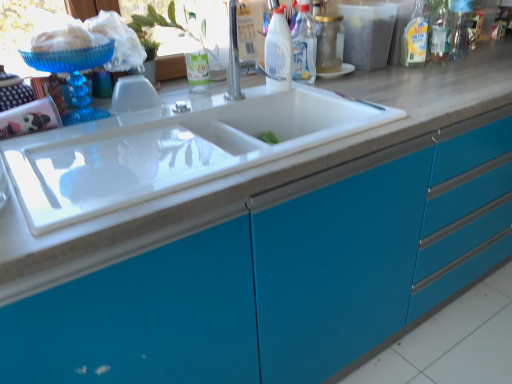
This screenshot has width=512, height=384. Find the location of `free space to the right of silver metallic faucet at upper center`. free space to the right of silver metallic faucet at upper center is located at coordinates (331, 97).